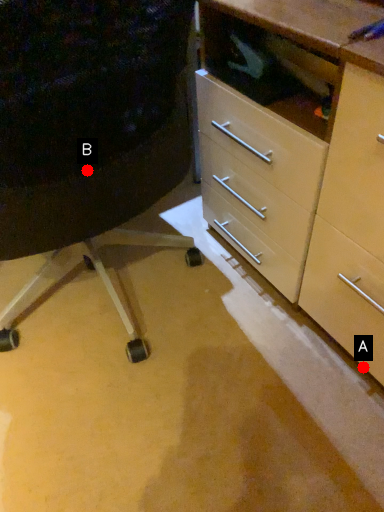
Question: Two points are circled on the image, labeled by A and B beside each circle. Which point is closer to the camera?

Choices:
 (A) A is closer
 (B) B is closer

Answer: (B)